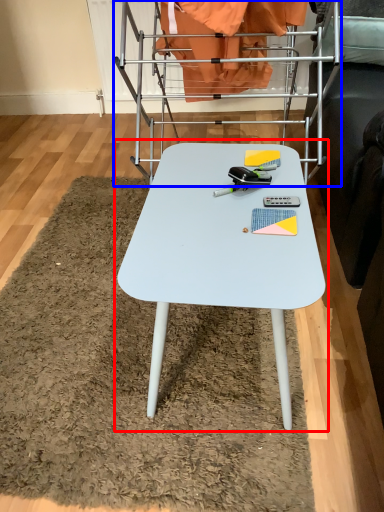
Question: Among these objects, which one is nearest to the camera, table (highlighted by a red box) or bunk bed (highlighted by a blue box)?

Choices:
 (A) table
 (B) bunk bed

Answer: (A)